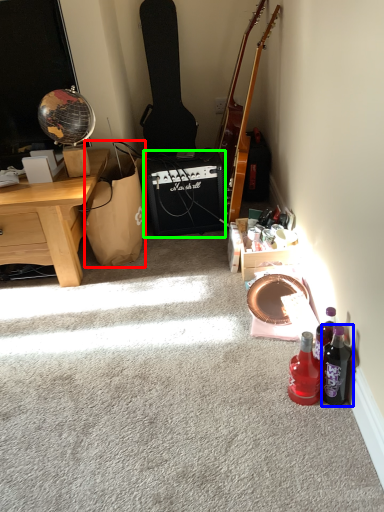
Question: Estimate the real-world distances between objects in this image. Which object is closer to handbag (highlighted by a red box), bottle (highlighted by a blue box) or loudspeaker (highlighted by a green box)?

Choices:
 (A) bottle
 (B) loudspeaker

Answer: (B)